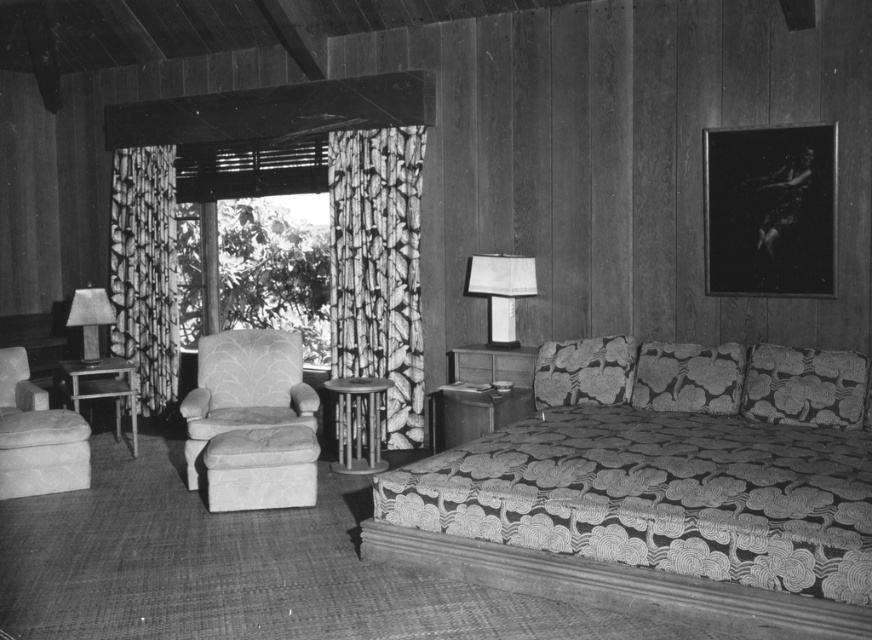
Question: Which of the following is the closest to the observer?

Choices:
 (A) (839, 396)
 (B) (377, 536)

Answer: (B)

Question: Which object is closer to the camera taking this photo?

Choices:
 (A) velvet beige armchair at lower left
 (B) floral-patterned fabric pillow at center

Answer: (B)

Question: Is patterned fabric curtain at left wider than velvet beige armchair at lower left?

Choices:
 (A) yes
 (B) no

Answer: (B)

Question: Can you confirm if patterned fabric couch at center is smaller than wooden side table at left?

Choices:
 (A) yes
 (B) no

Answer: (B)

Question: Is velvet beige armchair at lower left wider than matte gray lamp at left?

Choices:
 (A) yes
 (B) no

Answer: (A)

Question: Which of the following is the closest to the observer?

Choices:
 (A) (519, 282)
 (B) (550, 348)
 (C) (53, 468)

Answer: (C)